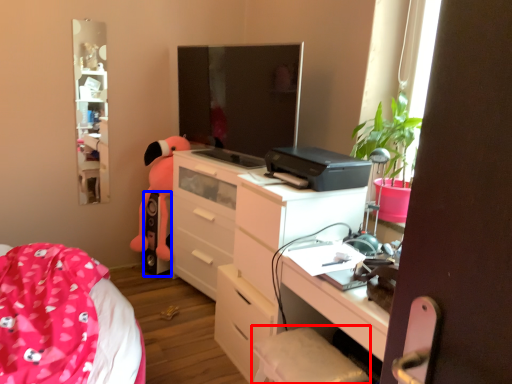
Question: Which point is closer to the camera, swivel chair (highlighted by a red box) or speaker (highlighted by a blue box)?

Choices:
 (A) swivel chair
 (B) speaker

Answer: (A)